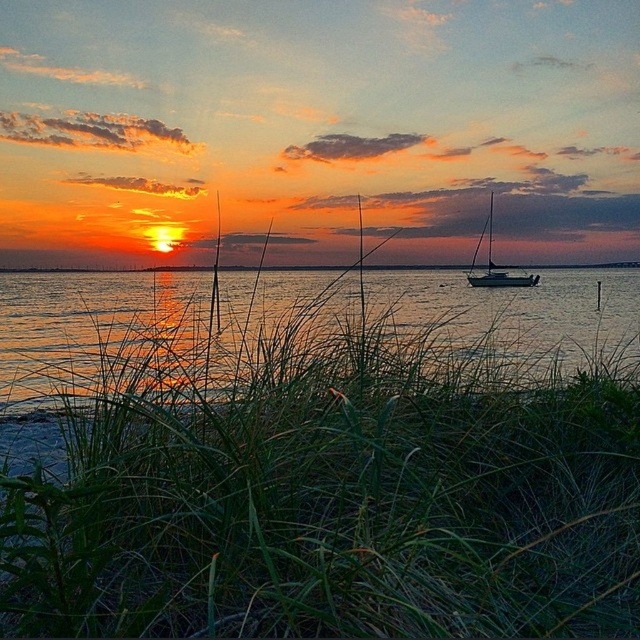
Question: Which of the following is the farthest from the observer?

Choices:
 (A) (468, 621)
 (B) (13, 314)
 (C) (492, 218)

Answer: (C)

Question: Is shiny reflective water at center above satin white sailboat at right?

Choices:
 (A) yes
 (B) no

Answer: (B)

Question: Is green grass at center bigger than shiny reflective water at center?

Choices:
 (A) no
 (B) yes

Answer: (A)

Question: Which point appears closest to the camera in this image?

Choices:
 (A) (557, 340)
 (B) (509, 284)
 (C) (307, 420)

Answer: (C)

Question: Is shiny reflective water at center behind satin white sailboat at right?

Choices:
 (A) no
 (B) yes

Answer: (A)

Question: Which object is the closest to the green grass at center?

Choices:
 (A) satin white sailboat at right
 (B) shiny reflective water at center

Answer: (B)